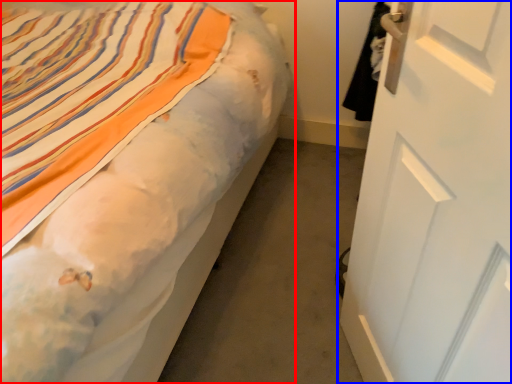
Question: Among these objects, which one is farthest to the camera, bed (highlighted by a red box) or door (highlighted by a blue box)?

Choices:
 (A) bed
 (B) door

Answer: (A)